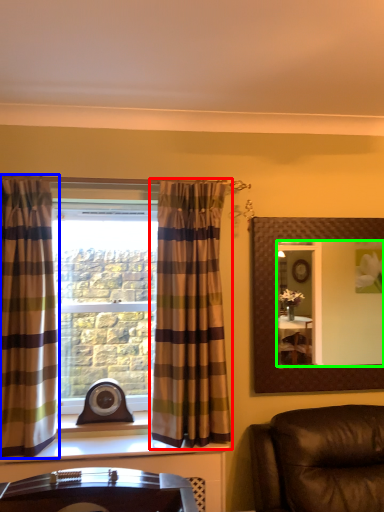
Question: Based on their relative distances, which object is nearer to curtain (highlighted by a red box)? Choose from curtain (highlighted by a blue box) and mirror (highlighted by a green box).

Choices:
 (A) curtain
 (B) mirror

Answer: (A)